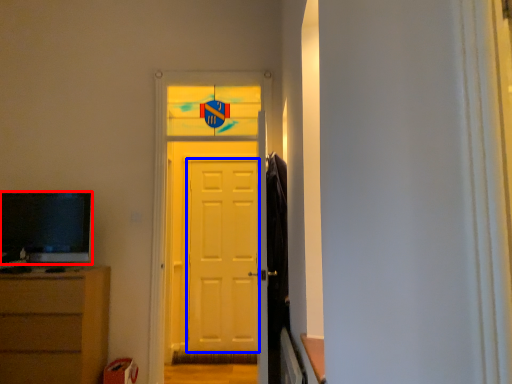
Question: Which object appears closest to the camera in this image, television (highlighted by a red box) or screen door (highlighted by a blue box)?

Choices:
 (A) television
 (B) screen door

Answer: (A)